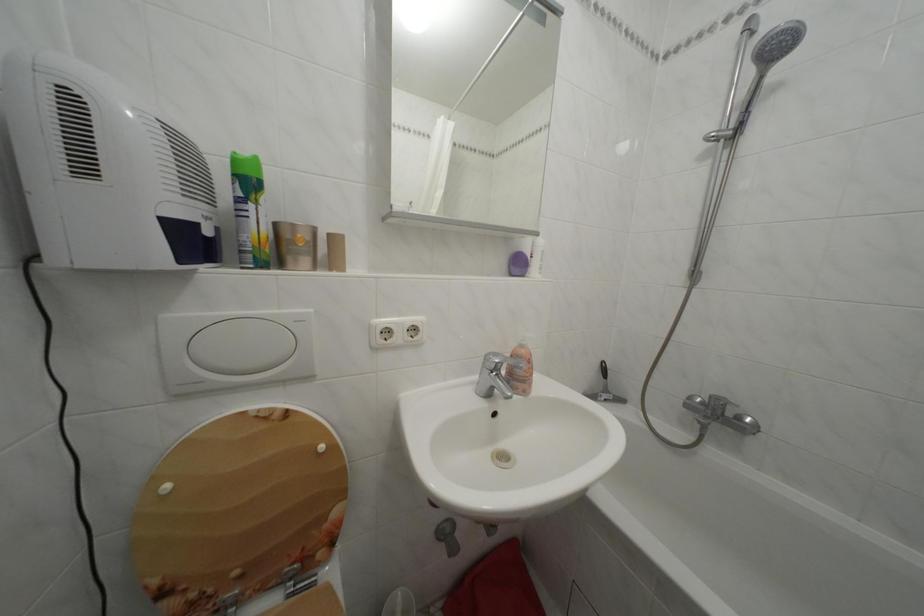
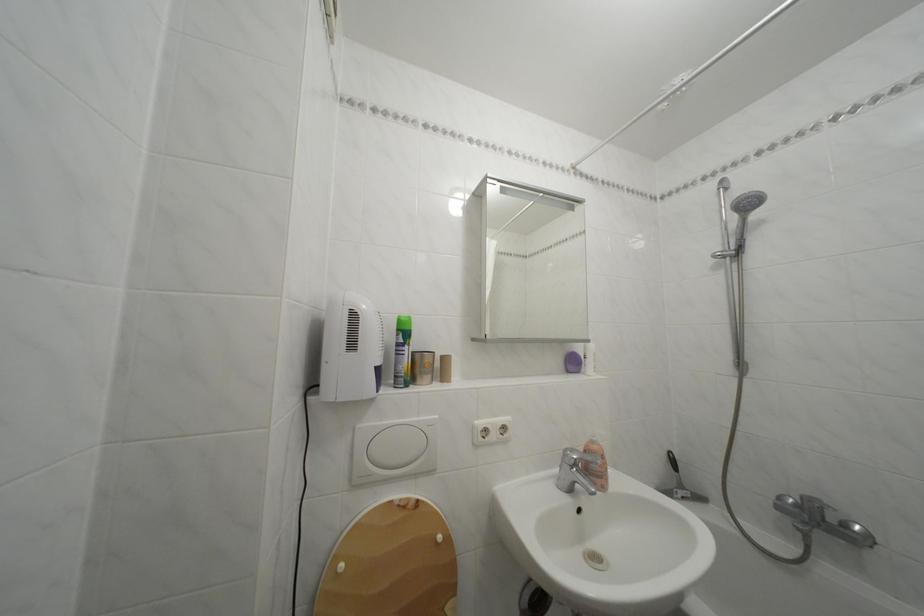
Where in the second image is the point corresponding to point 530,352 from the first image?

(602, 448)